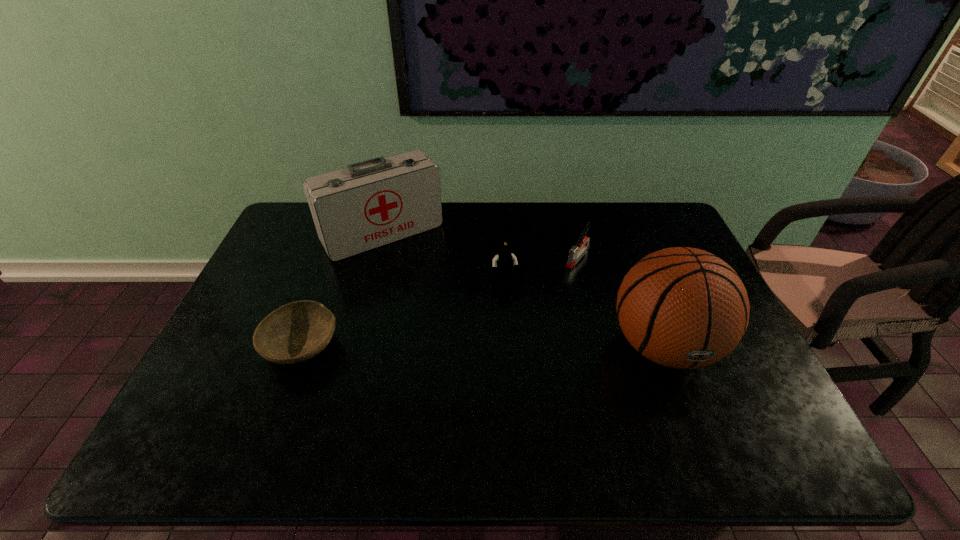
This screenshot has height=540, width=960. Identify the location of bowl. (295, 332).

Find the location of `basketball`. basketball is located at coordinates (681, 307).

Find the location of a particular element. Image resolution: width=960 pixels, height=540 pixels. the fourth tallest object is located at coordinates (575, 252).

I want to click on the first-aid kit, so click(x=372, y=203).

Where is `the third farthest object`? This screenshot has height=540, width=960. the third farthest object is located at coordinates (503, 263).

I want to click on the third object from right to left, so click(503, 263).

Identify the location of blank space located on the left of the shortest object. (242, 346).

The width and height of the screenshot is (960, 540). I want to click on vacant region located on the side where the inflation valve is located, so click(x=688, y=413).

Identify the location of vacant area situated 0.380m on the handle side of the second shortest object. [x=506, y=344].

You are a GUI agent. You are given a task and a screenshot of the screen. Output one action in this format:
    pyautogui.click(x=<x>, y=<y>)
    Task: Click on the vacant space located on the handle side of the second shortest object
    
    Given the screenshot: What is the action you would take?
    pyautogui.click(x=508, y=342)